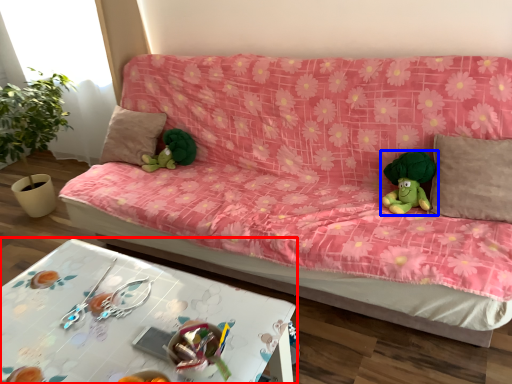
Question: Which object appears farthest to the camera in this image, table (highlighted by a red box) or toy (highlighted by a blue box)?

Choices:
 (A) table
 (B) toy

Answer: (B)